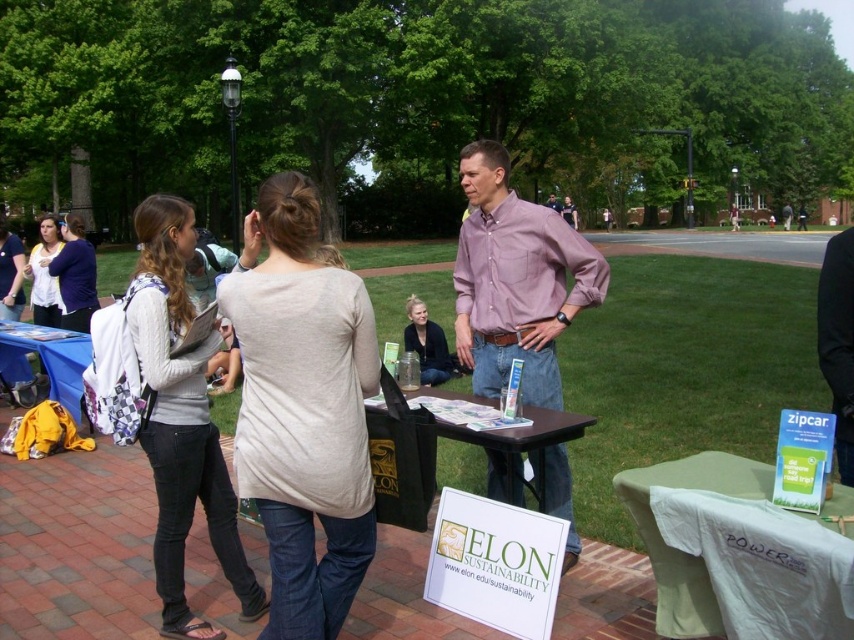
You are standing at the point labeled point [458,429] and want to move towards the point labeled point [632,502]. Which direction should you move to reach your destination?

You should move forward because point [632,502] is in front of point [458,429] from your current position.

What is the color of the clothing worn by the person located at point (303, 408) in the image?

The beige soft t shirt at center is represented by point (303, 408). So the color is beige.